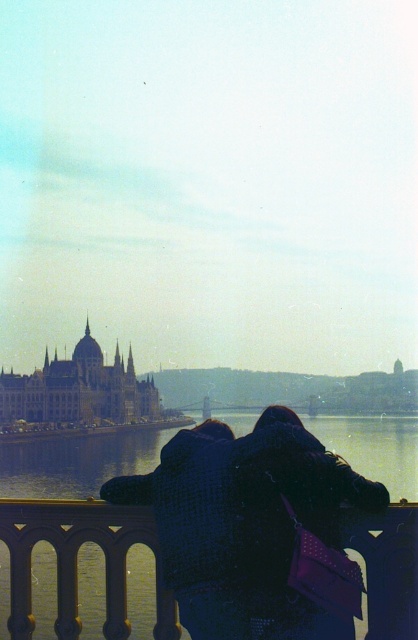
Question: Based on their relative distances, which object is farther from the golden stone palace at lower left?

Choices:
 (A) matte gold dome at center
 (B) clear water at lower center

Answer: (B)

Question: Does clear water at lower center have a lesser width compared to golden stone palace at lower left?

Choices:
 (A) yes
 (B) no

Answer: (B)

Question: Is clear water at lower center bigger than matte gold dome at center?

Choices:
 (A) yes
 (B) no

Answer: (A)

Question: Which of the following is the closest to the observer?

Choices:
 (A) (81, 355)
 (B) (417, 456)
 (C) (101, 365)

Answer: (B)

Question: Which point is farther from the camera taking this photo?

Choices:
 (A) (40, 392)
 (B) (83, 476)

Answer: (A)

Question: Can you confirm if golden stone palace at lower left is positioned to the left of matte gold dome at center?

Choices:
 (A) no
 (B) yes

Answer: (A)